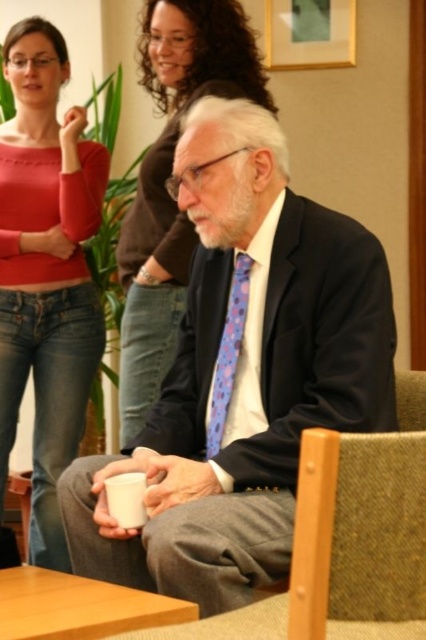
Question: Can you confirm if blue dotted tie at center is positioned below wooden chair at lower left?

Choices:
 (A) yes
 (B) no

Answer: (B)

Question: Which point is farther to the camera?

Choices:
 (A) light brown wood table at lower left
 (B) wooden chair at lower left
 (C) matte red sweater at upper left

Answer: (B)

Question: Is blue dotted tie at center thinner than wooden chair at lower left?

Choices:
 (A) no
 (B) yes

Answer: (B)

Question: Which point is farther to the camera?

Choices:
 (A) blue dotted tie at center
 (B) matte black suit at center
 (C) white matte cup at lower center

Answer: (A)

Question: Which of these objects is positioned farthest from the white matte cup at lower center?

Choices:
 (A) blue dotted tie at center
 (B) matte red sweater at upper left

Answer: (B)

Question: Does matte red sweater at upper left have a smaller size compared to white matte cup at lower center?

Choices:
 (A) no
 (B) yes

Answer: (A)